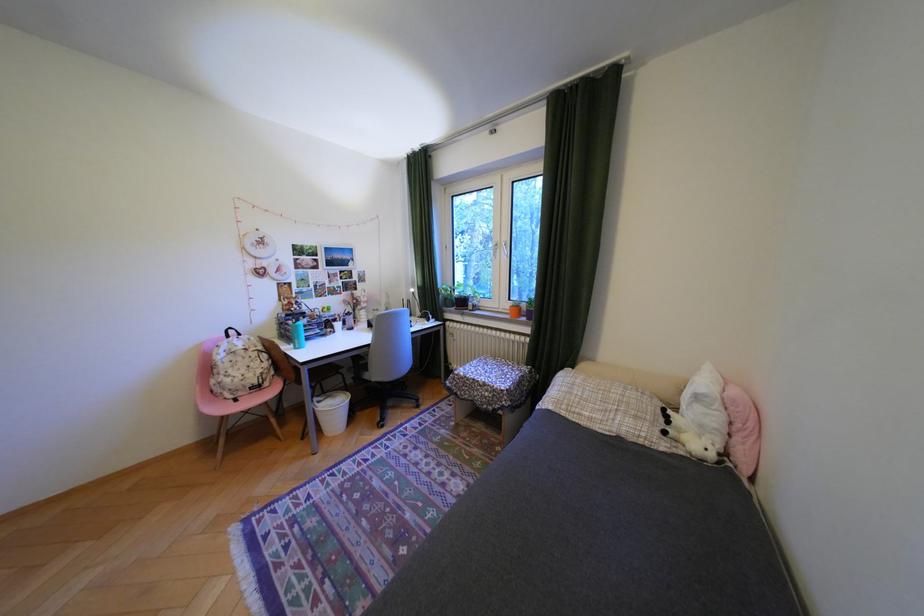
Where would you lift the small potted plant? Please return your answer as a coordinate pair (x, y).

(458, 294)